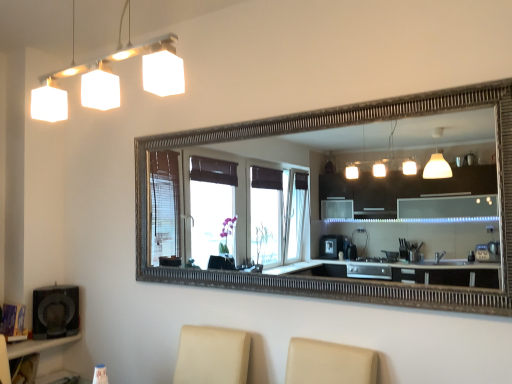
Question: From a real-world perspective, is matte black shelf at lower left over white matte square light fixture at upper left?

Choices:
 (A) no
 (B) yes

Answer: (A)

Question: Is matte black shelf at lower left not inside white matte square light fixture at upper left?

Choices:
 (A) no
 (B) yes

Answer: (B)

Question: Is matte black shelf at lower left facing towards white matte square light fixture at upper left?

Choices:
 (A) no
 (B) yes

Answer: (A)

Question: Can you confirm if matte black shelf at lower left is positioned to the left of white matte square light fixture at upper left?

Choices:
 (A) no
 (B) yes

Answer: (B)

Question: Is matte black shelf at lower left turned away from white matte square light fixture at upper left?

Choices:
 (A) no
 (B) yes

Answer: (A)

Question: Can you confirm if matte black shelf at lower left is shorter than white matte square light fixture at upper left?

Choices:
 (A) no
 (B) yes

Answer: (A)

Question: Is white matte square light fixture at upper left bigger than matte black speaker at lower left?

Choices:
 (A) no
 (B) yes

Answer: (A)

Question: Considering the relative positions of white matte square light fixture at upper left and matte black speaker at lower left in the image provided, is white matte square light fixture at upper left to the right of matte black speaker at lower left from the viewer's perspective?

Choices:
 (A) yes
 (B) no

Answer: (A)

Question: Considering the relative sizes of white matte square light fixture at upper left and matte black speaker at lower left in the image provided, is white matte square light fixture at upper left shorter than matte black speaker at lower left?

Choices:
 (A) yes
 (B) no

Answer: (B)

Question: Is white matte square light fixture at upper left with matte black speaker at lower left?

Choices:
 (A) yes
 (B) no

Answer: (B)

Question: From the image's perspective, is white matte square light fixture at upper left above matte black speaker at lower left?

Choices:
 (A) no
 (B) yes

Answer: (B)

Question: Is white matte square light fixture at upper left facing towards matte black speaker at lower left?

Choices:
 (A) yes
 (B) no

Answer: (B)

Question: Does matte black shelf at lower left turn towards matte black speaker at lower left?

Choices:
 (A) yes
 (B) no

Answer: (B)